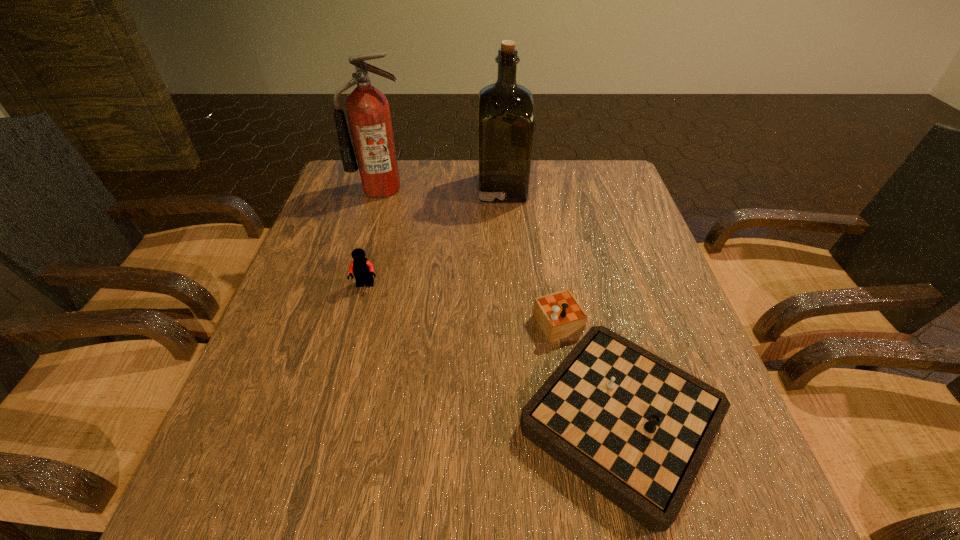
Locate an element on the screen. The image size is (960, 540). vacant region located 0.270m on the back of the shortest object is located at coordinates (573, 229).

Locate an element on the screen. liquor at the far edge is located at coordinates (505, 110).

You are a GUI agent. You are given a task and a screenshot of the screen. Output one action in this format:
    pyautogui.click(x=<x>, y=<y>)
    Task: Click on the fire extinguisher that is at the far edge
    The image size is (960, 540).
    Given the screenshot: What is the action you would take?
    pyautogui.click(x=368, y=111)

Find the location of a particular element. Image resolution: width=960 pixels, height=540 pixels. object that is at the near edge is located at coordinates (636, 428).

Find the location of a particular element. fire extinguisher positioned at the left edge is located at coordinates (368, 111).

Identify the location of Lego present at the left edge. The image size is (960, 540). (362, 269).

Locate an element on the screen. This screenshot has height=540, width=960. object positioned at the right edge is located at coordinates (636, 428).

Where is `object positioned at the far left corner`? object positioned at the far left corner is located at coordinates (368, 111).

Where is `object present at the near right corner`? The width and height of the screenshot is (960, 540). object present at the near right corner is located at coordinates point(636,428).

I want to click on free region at the far edge of the desktop, so point(450,168).